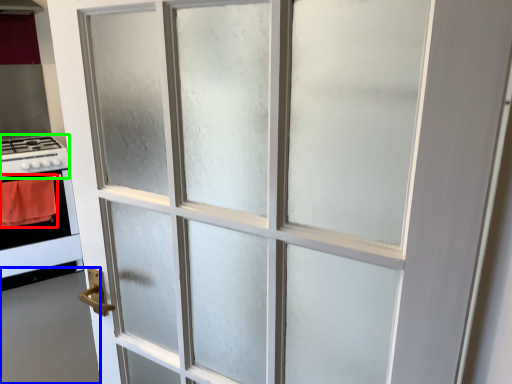
Question: Considering the real-world distances, which object is closest to blanket (highlighted by a red box)? door (highlighted by a blue box) or gas stove (highlighted by a green box).

Choices:
 (A) door
 (B) gas stove

Answer: (B)